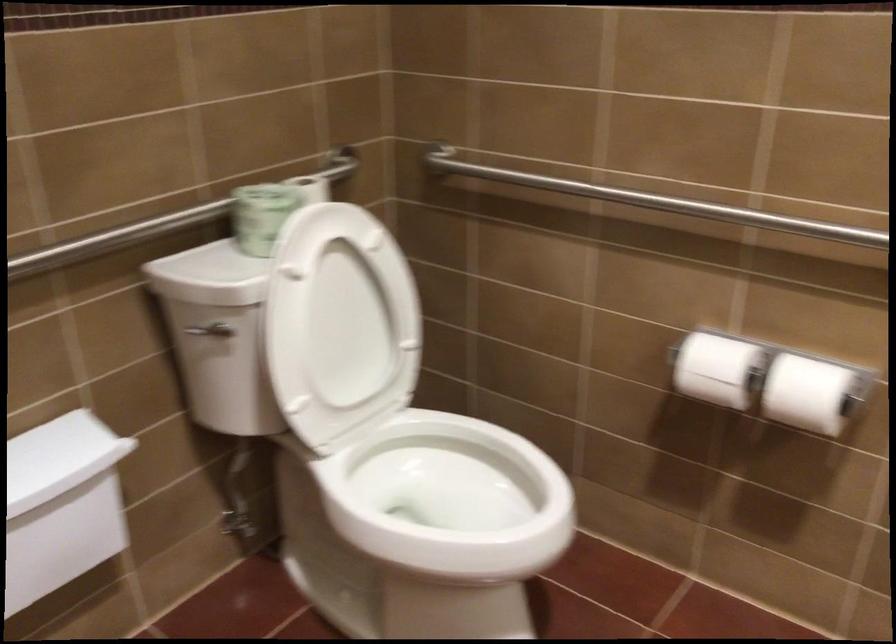
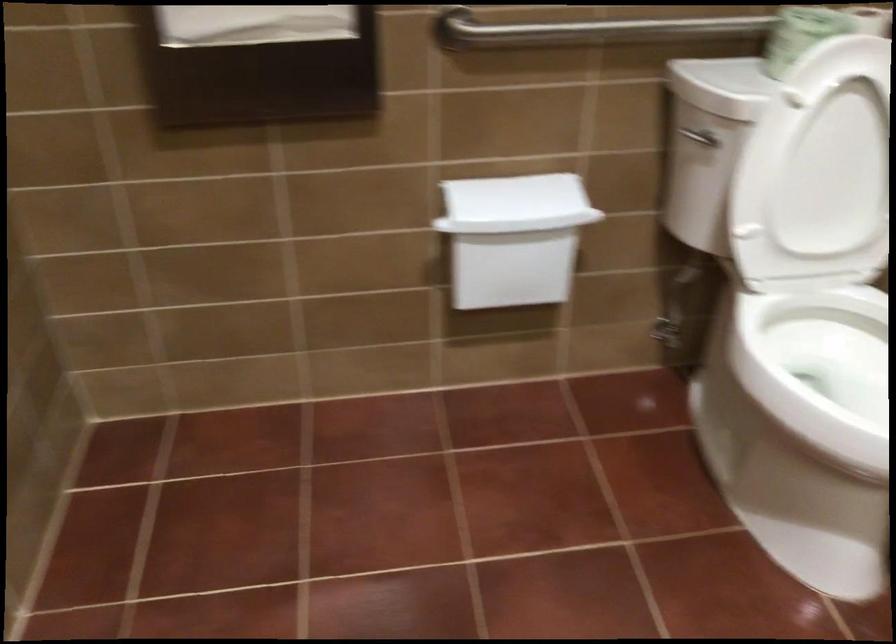
Find the pixel in the second image that matches point (403, 497) in the first image.

(819, 368)